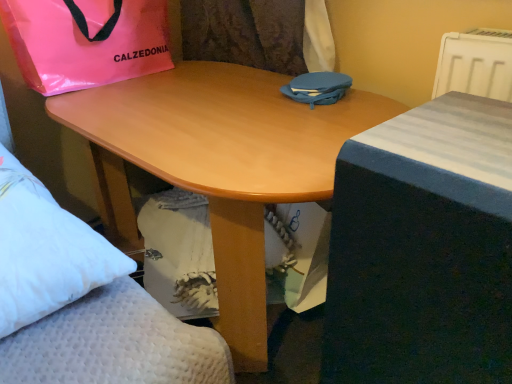
Where is `blue fabric bag at center, acting as the 2th bag starting from the left`? Image resolution: width=512 pixels, height=384 pixels. blue fabric bag at center, acting as the 2th bag starting from the left is located at coordinates (317, 88).

Based on the photo, measure the distance between blue fabric bed at right and camera.

A distance of 15.68 inches exists between blue fabric bed at right and camera.

The height and width of the screenshot is (384, 512). What do you see at coordinates (218, 164) in the screenshot?
I see `light wood desk at center` at bounding box center [218, 164].

The image size is (512, 384). I want to click on white plastic radiator at upper right, so click(474, 66).

This screenshot has height=384, width=512. Identify the location of pink plastic bag at upper left, placed as the second bag when sorted from right to left. (86, 41).

Based on the photo, is white plastic radiator at upper right to the left or to the right of pink plastic bag at upper left, which is the 1th bag in left-to-right order, in the image?

Clearly, white plastic radiator at upper right is on the right of pink plastic bag at upper left, which is the 1th bag in left-to-right order, in the image.

From a real-world perspective, does white plastic radiator at upper right stand above pink plastic bag at upper left, placed as the second bag when sorted from right to left?

No, from a real-world perspective, white plastic radiator at upper right is not on top of pink plastic bag at upper left, placed as the second bag when sorted from right to left.

From the picture: Who is bigger, white plastic radiator at upper right or pink plastic bag at upper left, placed as the second bag when sorted from right to left?

pink plastic bag at upper left, placed as the second bag when sorted from right to left, is bigger.

Is light wood desk at center with blue fabric bag at center, acting as the 2th bag starting from the left?

No, light wood desk at center is not next to blue fabric bag at center, acting as the 2th bag starting from the left.

In terms of height, does light wood desk at center look taller or shorter compared to blue fabric bag at center, acting as the 2th bag starting from the left?

Clearly, light wood desk at center is taller compared to blue fabric bag at center, acting as the 2th bag starting from the left.

Can you confirm if light wood desk at center is thinner than blue fabric bag at center, placed as the 1th bag when sorted from right to left?

No, light wood desk at center is not thinner than blue fabric bag at center, placed as the 1th bag when sorted from right to left.

Would you say light wood desk at center is to the left or to the right of blue fabric bag at center, acting as the 2th bag starting from the left, in the picture?

light wood desk at center is positioned on blue fabric bag at center, acting as the 2th bag starting from the left,'s left side.

Does light wood desk at center have a larger size compared to pink plastic bag at upper left, which is the 1th bag in left-to-right order?

Indeed, light wood desk at center has a larger size compared to pink plastic bag at upper left, which is the 1th bag in left-to-right order.

Does light wood desk at center turn towards pink plastic bag at upper left, which is the 1th bag in left-to-right order?

No, light wood desk at center does not turn towards pink plastic bag at upper left, which is the 1th bag in left-to-right order.

Is light wood desk at center at the right side of pink plastic bag at upper left, placed as the second bag when sorted from right to left?

Yes.

Is light wood desk at center directly adjacent to pink plastic bag at upper left, which is the 1th bag in left-to-right order?

No, light wood desk at center is not making contact with pink plastic bag at upper left, which is the 1th bag in left-to-right order.

From the image's perspective, is light wood desk at center positioned above or below blue fabric bed at right?

Based on their image positions, light wood desk at center is located above blue fabric bed at right.

In the scene shown: Considering the positions of objects light wood desk at center and blue fabric bed at right in the image provided, who is more to the left, light wood desk at center or blue fabric bed at right?

light wood desk at center is more to the left.

Is light wood desk at center spatially inside blue fabric bed at right, or outside of it?

light wood desk at center is not enclosed by blue fabric bed at right.

Is light wood desk at center looking in the opposite direction of blue fabric bed at right?

No, light wood desk at center is not facing away from blue fabric bed at right.

Is blue fabric bag at center, placed as the 1th bag when sorted from right to left, wider or thinner than white plastic radiator at upper right?

Clearly, blue fabric bag at center, placed as the 1th bag when sorted from right to left, has more width compared to white plastic radiator at upper right.

Is blue fabric bag at center, placed as the 1th bag when sorted from right to left, smaller than white plastic radiator at upper right?

Correct, blue fabric bag at center, placed as the 1th bag when sorted from right to left, occupies less space than white plastic radiator at upper right.

Could you tell me if pink plastic bag at upper left, which is the 1th bag in left-to-right order, is facing blue fabric bed at right?

Yes.

Does point (17, 46) lie in front of point (454, 166)?

No, it is not.

How much distance is there between pink plastic bag at upper left, which is the 1th bag in left-to-right order, and blue fabric bed at right?

36.71 inches.

From the image's perspective, between pink plastic bag at upper left, which is the 1th bag in left-to-right order, and blue fabric bed at right, who is located below?

blue fabric bed at right is shown below in the image.

Can blue fabric bag at center, placed as the 1th bag when sorted from right to left, be found inside white plastic radiator at upper right?

No, blue fabric bag at center, placed as the 1th bag when sorted from right to left, is not inside white plastic radiator at upper right.

Which object is positioned more to the left, white plastic radiator at upper right or blue fabric bag at center, placed as the 1th bag when sorted from right to left?

Positioned to the left is blue fabric bag at center, placed as the 1th bag when sorted from right to left.

At what (x,y) coordinates should I click in order to perform the action: click on the 1st bag behind when counting from the white plastic radiator at upper right. Please return your answer as a coordinate pair (x, y). Looking at the image, I should click on (317, 88).

How different are the orientations of white plastic radiator at upper right and blue fabric bag at center, placed as the 1th bag when sorted from right to left, in degrees?

white plastic radiator at upper right and blue fabric bag at center, placed as the 1th bag when sorted from right to left, are facing 0.576 degrees away from each other.

Image resolution: width=512 pixels, height=384 pixels. Find the location of `the 2nd bag to the left of the white plastic radiator at upper right, starting your count from the anchor`. the 2nd bag to the left of the white plastic radiator at upper right, starting your count from the anchor is located at coordinates (86, 41).

From the light wood desk at center, count 1st bags backward and point to it. Please provide its 2D coordinates.

[(317, 88)]

Estimate the real-world distances between objects in this image. Which object is further from blue fabric bed at right, light wood desk at center or white plastic radiator at upper right?

Based on the image, white plastic radiator at upper right appears to be further to blue fabric bed at right.

Looking at this image, based on their spatial positions, is light wood desk at center or blue fabric bed at right closer to pink plastic bag at upper left, which is the 1th bag in left-to-right order?

light wood desk at center.

When comparing their distances from pink plastic bag at upper left, which is the 1th bag in left-to-right order, does light wood desk at center or blue fabric bag at center, placed as the 1th bag when sorted from right to left, seem closer?

light wood desk at center is positioned closer to the anchor pink plastic bag at upper left, which is the 1th bag in left-to-right order.

Based on their spatial positions, is blue fabric bed at right or light wood desk at center further from blue fabric bag at center, acting as the 2th bag starting from the left?

blue fabric bed at right is further to blue fabric bag at center, acting as the 2th bag starting from the left.

Based on their spatial positions, is blue fabric bed at right or blue fabric bag at center, acting as the 2th bag starting from the left, closer to white plastic radiator at upper right?

blue fabric bag at center, acting as the 2th bag starting from the left, is positioned closer to the anchor white plastic radiator at upper right.

Looking at the image, which one is located closer to light wood desk at center, blue fabric bed at right or pink plastic bag at upper left, which is the 1th bag in left-to-right order?

blue fabric bed at right lies closer to light wood desk at center than the other object.

Estimate the real-world distances between objects in this image. Which object is closer to white plastic radiator at upper right, light wood desk at center or blue fabric bed at right?

Based on the image, blue fabric bed at right appears to be nearer to white plastic radiator at upper right.

Considering their positions, is white plastic radiator at upper right positioned further to blue fabric bed at right than blue fabric bag at center, placed as the 1th bag when sorted from right to left?

blue fabric bag at center, placed as the 1th bag when sorted from right to left, is further to blue fabric bed at right.

This screenshot has width=512, height=384. Find the location of `desk located between pink plastic bag at upper left, placed as the second bag when sorted from right to left, and white plastic radiator at upper right in the left-right direction`. desk located between pink plastic bag at upper left, placed as the second bag when sorted from right to left, and white plastic radiator at upper right in the left-right direction is located at coordinates (218, 164).

The image size is (512, 384). I want to click on table situated between pink plastic bag at upper left, which is the 1th bag in left-to-right order, and white plastic radiator at upper right from left to right, so coord(423,248).

The image size is (512, 384). Identify the location of table between light wood desk at center and white plastic radiator at upper right in the horizontal direction. (423, 248).

Identify the location of bag between light wood desk at center and white plastic radiator at upper right in the horizontal direction. click(317, 88).